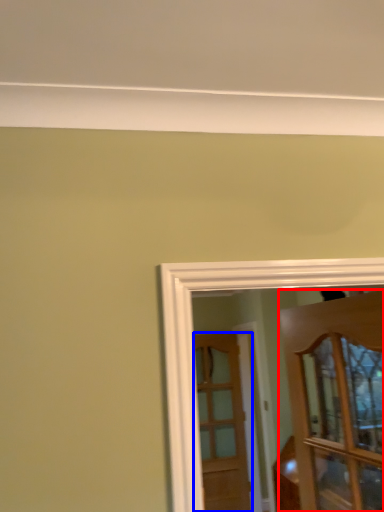
Question: Among these objects, which one is farthest to the camera, door (highlighted by a red box) or door (highlighted by a blue box)?

Choices:
 (A) door
 (B) door

Answer: (B)